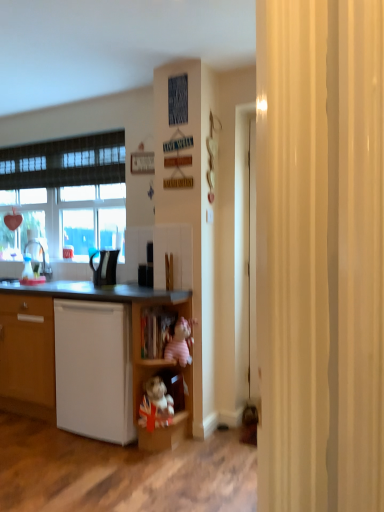
Identify the location of vacant region to the left of white matte dishwasher at lower left. The height and width of the screenshot is (512, 384). (32, 435).